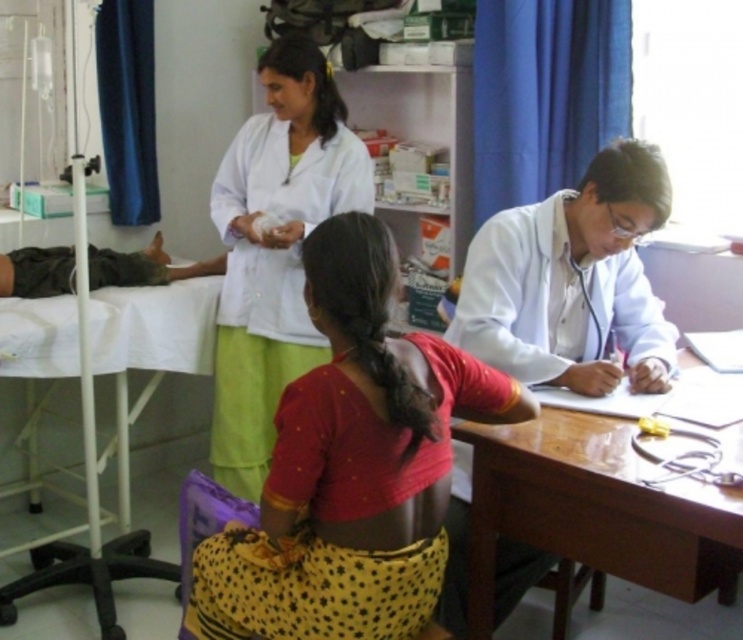
Question: Is white glossy coat at center positioned in front of dark green fabric leg at left?

Choices:
 (A) no
 (B) yes

Answer: (B)

Question: Which is nearer to the white smooth coat at upper center?

Choices:
 (A) white glossy coat at center
 (B) dark green fabric leg at left
 (C) wooden table at center
 (D) red cotton saree at center

Answer: (B)

Question: Estimate the real-world distances between objects in this image. Which object is closer to the white glossy coat at center?

Choices:
 (A) dark green fabric leg at left
 (B) white smooth coat at upper center

Answer: (B)

Question: Considering the relative positions of white glossy coat at center and wooden table at center in the image provided, where is white glossy coat at center located with respect to wooden table at center?

Choices:
 (A) left
 (B) right

Answer: (B)

Question: Among these points, which one is farthest from the camera?

Choices:
 (A) (562, 362)
 (B) (438, 524)
 (C) (22, 282)
 (D) (580, 472)

Answer: (C)

Question: Does red cotton saree at center have a greater width compared to wooden table at center?

Choices:
 (A) no
 (B) yes

Answer: (B)